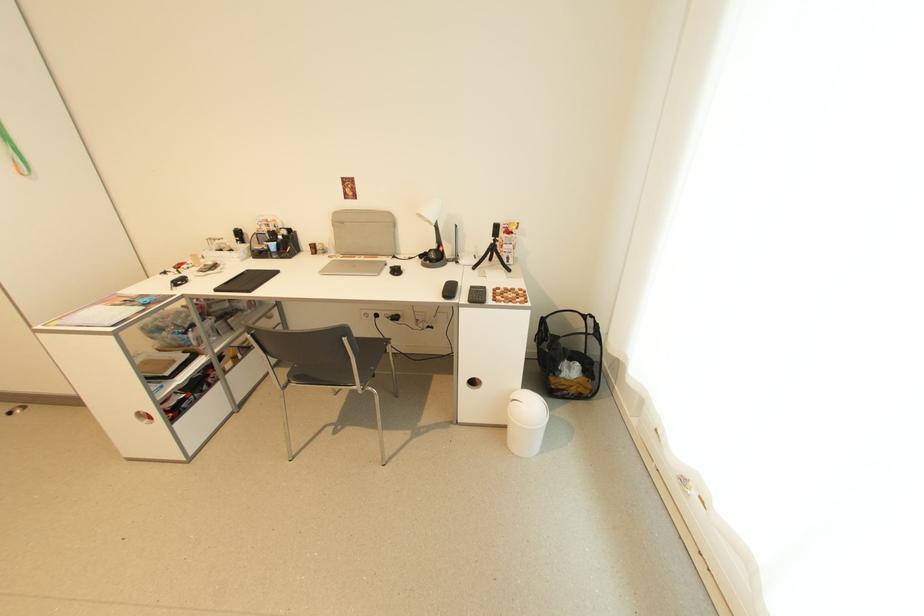
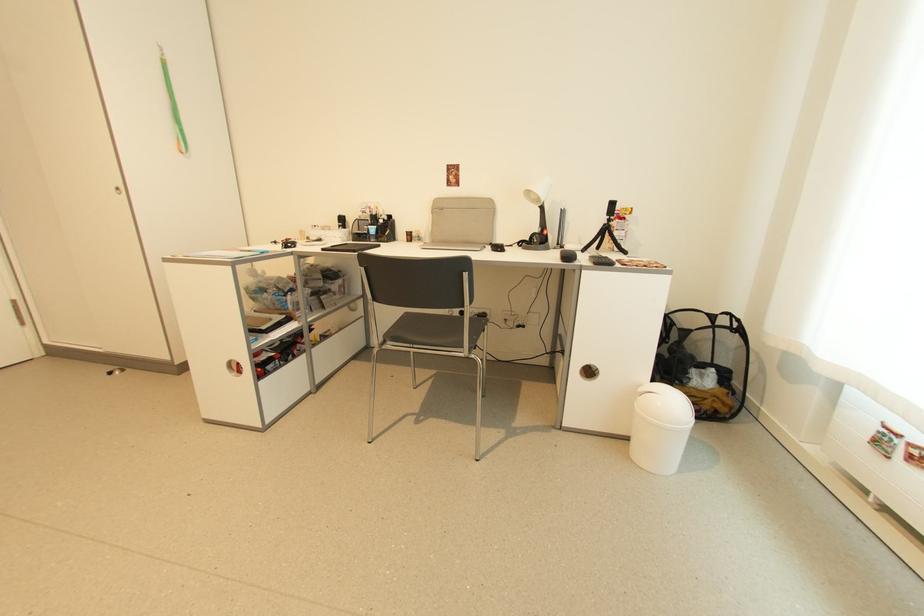
Locate, in the second image, the point that corresponds to (497,238) in the first image.

(612, 217)